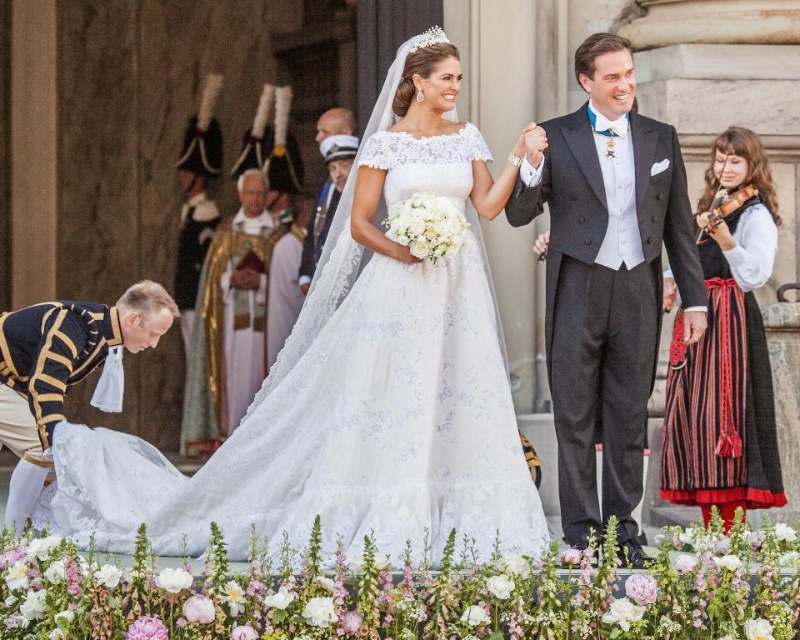
You are standing in the wedding scene and want to place a bouquet between the two points, point (440, 424) and point (646, 376). Which point should you place it closer to in order to make it appear larger?

To make the bouquet appear larger, place it closer to point (440, 424) since it is closer to the viewer than point (646, 376).

You are attending a royal wedding and notice a point marked at coordinates (606, 280). Based on the scene description, what object or element is located at this point?

The point at coordinates (606, 280) marks the smooth black suit at upper right.

You are a photographer at the wedding and want to capture a closeup of the white lace dress at center and the smooth black suit at upper right. Which one will appear larger in the photo?

The white lace dress at center will appear larger in the photo because it is closer to the viewer than the smooth black suit at upper right.